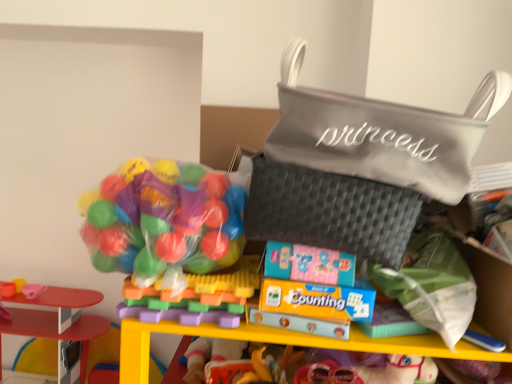
Question: From the image's perspective, is green fabric pouch at lower right, the 3th pouch from the top, located beneath translucent plastic balls at left, which is the 1th toy from right to left?

Choices:
 (A) no
 (B) yes

Answer: (B)

Question: Does green fabric pouch at lower right, which is the 1th pouch in bottom-to-top order, have a lesser width compared to translucent plastic balls at left, which is the 1th toy from right to left?

Choices:
 (A) no
 (B) yes

Answer: (B)

Question: Considering the relative sizes of green fabric pouch at lower right, which is the 1th pouch in bottom-to-top order, and translucent plastic balls at left, the 3th toy positioned from the bottom, in the image provided, is green fabric pouch at lower right, which is the 1th pouch in bottom-to-top order, wider than translucent plastic balls at left, the 3th toy positioned from the bottom,?

Choices:
 (A) no
 (B) yes

Answer: (A)

Question: From a real-world perspective, is green fabric pouch at lower right, the 3th pouch from the top, over translucent plastic balls at left, the 3th toy viewed from the back?

Choices:
 (A) yes
 (B) no

Answer: (A)

Question: Is green fabric pouch at lower right, which is the 1th pouch in bottom-to-top order, smaller than translucent plastic balls at left, the 3th toy viewed from the back?

Choices:
 (A) yes
 (B) no

Answer: (A)

Question: From a real-world perspective, is translucent plastic balls at left positioned above or below matte black pouch at center, positioned as the 2th pouch in top-to-bottom order?

Choices:
 (A) above
 (B) below

Answer: (B)

Question: Is point (181, 170) positioned closer to the camera than point (335, 230)?

Choices:
 (A) closer
 (B) farther

Answer: (B)

Question: In terms of height, does translucent plastic balls at left look taller or shorter compared to matte black pouch at center, acting as the second pouch starting from the bottom?

Choices:
 (A) tall
 (B) short

Answer: (A)

Question: From the image's perspective, is translucent plastic balls at left above or below matte black pouch at center, acting as the second pouch starting from the bottom?

Choices:
 (A) below
 (B) above

Answer: (A)

Question: Is gray quilted pouch at upper right, placed as the third pouch when sorted from bottom to top, bigger or smaller than green fabric pouch at lower right, the 3th pouch from the top?

Choices:
 (A) big
 (B) small

Answer: (A)

Question: Considering the positions of gray quilted pouch at upper right, which ranks as the 1th pouch in top-to-bottom order, and green fabric pouch at lower right, which is the 1th pouch in bottom-to-top order, in the image, is gray quilted pouch at upper right, which ranks as the 1th pouch in top-to-bottom order, wider or thinner than green fabric pouch at lower right, which is the 1th pouch in bottom-to-top order,?

Choices:
 (A) wide
 (B) thin

Answer: (A)

Question: Considering the positions of point (431, 117) and point (365, 266), is point (431, 117) closer or farther from the camera than point (365, 266)?

Choices:
 (A) farther
 (B) closer

Answer: (B)

Question: Is gray quilted pouch at upper right, placed as the third pouch when sorted from bottom to top, in front of or behind green fabric pouch at lower right, which is the 1th pouch in bottom-to-top order, in the image?

Choices:
 (A) front
 (B) behind

Answer: (A)

Question: Which is correct: green fabric pouch at lower right, the 3th pouch from the top, is inside smooth plastic toy house at lower left, the 2th toy positioned from the right, or outside of it?

Choices:
 (A) outside
 (B) inside

Answer: (A)

Question: Considering their positions, is green fabric pouch at lower right, which is the 1th pouch in bottom-to-top order, located in front of or behind smooth plastic toy house at lower left, which appears as the 1th toy when ordered from the bottom?

Choices:
 (A) front
 (B) behind

Answer: (A)